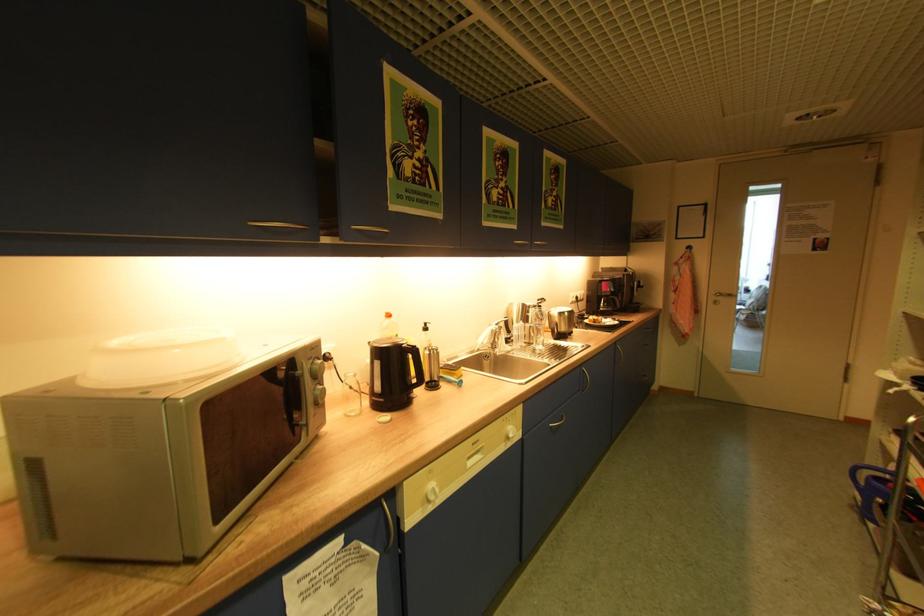
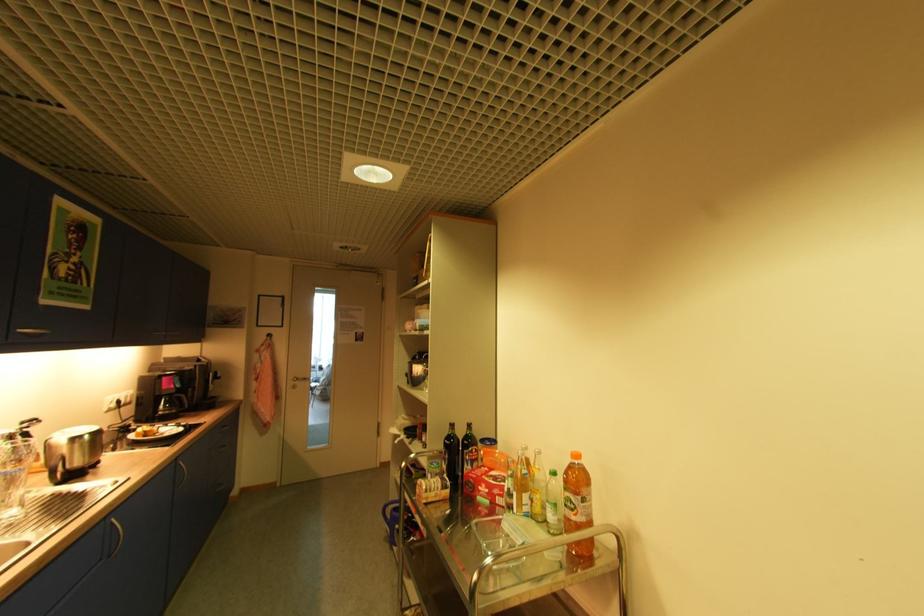
Locate, in the second image, the point that corresponds to (x=882, y=480) in the first image.

(400, 509)